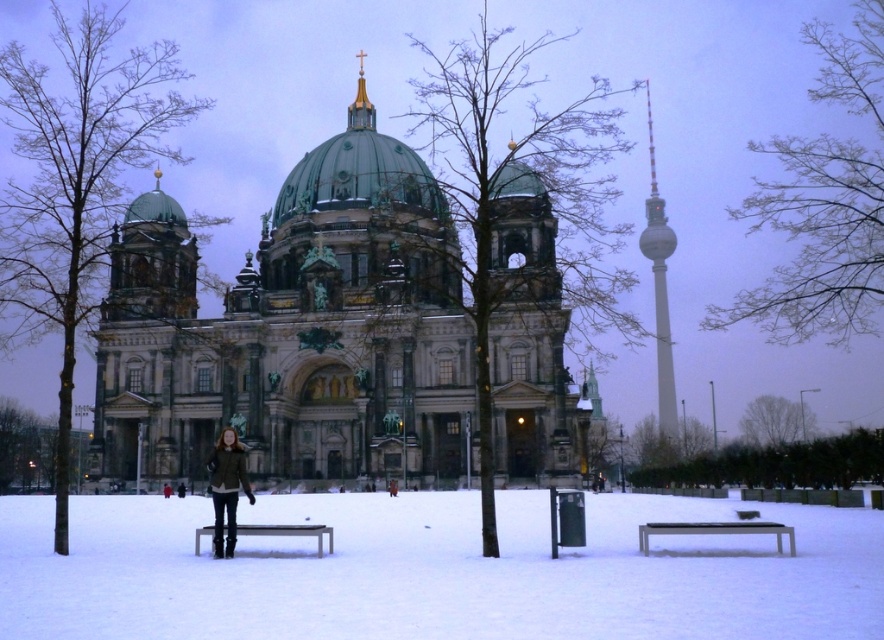
Based on the photo, which is below, brown leather jacket at center or metallic silver bench at lower right?

metallic silver bench at lower right is lower down.

Can you confirm if brown leather jacket at center is taller than metallic silver bench at lower right?

Correct, brown leather jacket at center is much taller as metallic silver bench at lower right.

Where is `brown leather jacket at center`? Image resolution: width=884 pixels, height=640 pixels. brown leather jacket at center is located at coordinates (x=226, y=486).

Does green stone church at center have a lesser height compared to metallic silver bench at center?

Incorrect, green stone church at center's height does not fall short of metallic silver bench at center's.

Who is higher up, green stone church at center or metallic silver bench at center?

Positioned higher is green stone church at center.

Does point (318, 145) come in front of point (322, 531)?

No, (318, 145) is further to viewer.

Find the location of a particular element. green stone church at center is located at coordinates click(x=295, y=332).

Between white matte snow at center and metallic silver bench at lower right, which one is positioned higher?

metallic silver bench at lower right is higher up.

Between point (204, 595) and point (751, 525), which one is positioned behind?

Point (751, 525)

I want to click on white matte snow at center, so click(x=435, y=570).